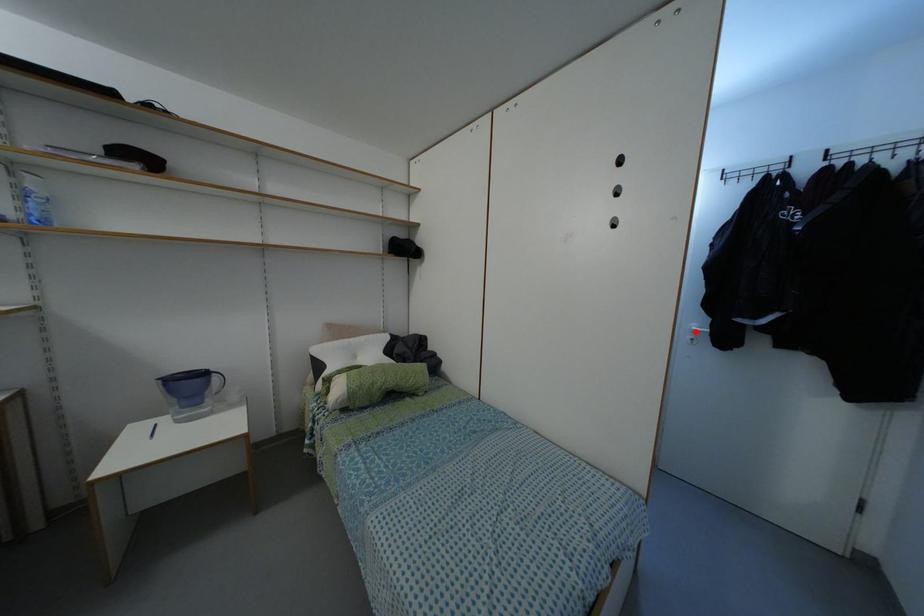
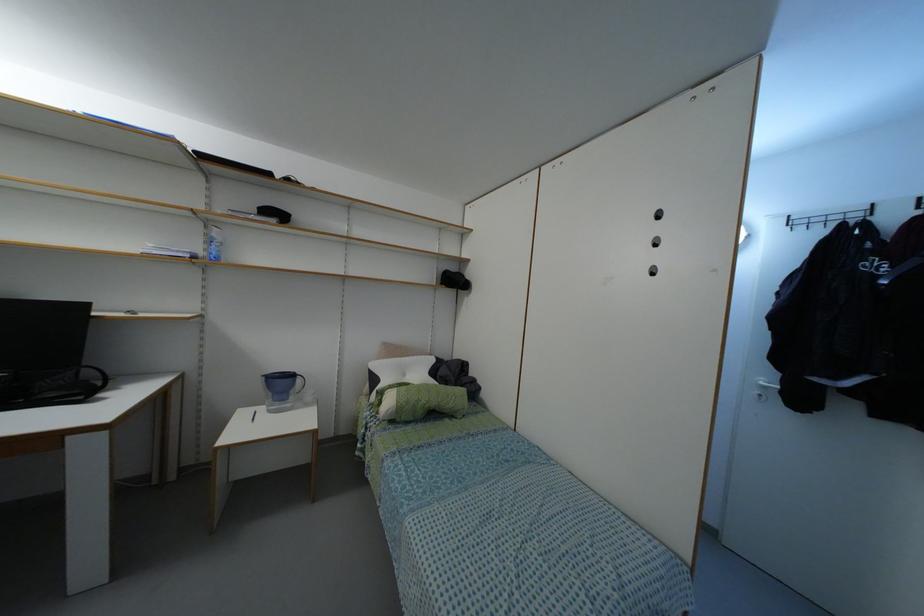
Question: I am providing you with two images of the same scene from different viewpoints. A red point is marked on the first image. Can you still see the location of the red point in image 2?

Choices:
 (A) Yes
 (B) No

Answer: (A)